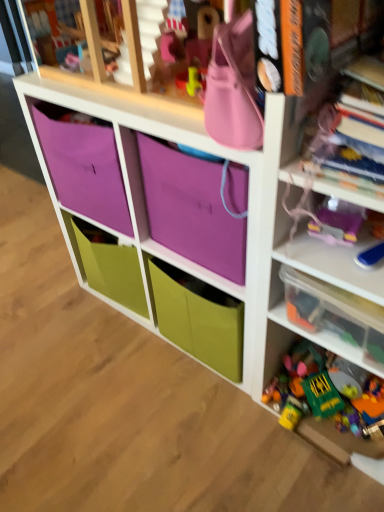
Question: Is purple fabric storage at center turned away from clear plastic container at right?

Choices:
 (A) yes
 (B) no

Answer: (B)

Question: Are purple fabric storage at center and clear plastic container at right far apart?

Choices:
 (A) yes
 (B) no

Answer: (B)

Question: Considering the relative sizes of purple fabric storage at center and clear plastic container at right in the image provided, is purple fabric storage at center thinner than clear plastic container at right?

Choices:
 (A) yes
 (B) no

Answer: (B)

Question: Considering the relative positions of purple fabric storage at center and clear plastic container at right in the image provided, is purple fabric storage at center to the left of clear plastic container at right from the viewer's perspective?

Choices:
 (A) no
 (B) yes

Answer: (B)

Question: Is purple fabric storage at center next to clear plastic container at right and touching it?

Choices:
 (A) yes
 (B) no

Answer: (B)

Question: Considering the relative sizes of purple fabric storage at center and clear plastic container at right in the image provided, is purple fabric storage at center wider than clear plastic container at right?

Choices:
 (A) no
 (B) yes

Answer: (B)

Question: Considering the relative positions of translucent plastic toys at right and purple fabric bag at upper center in the image provided, is translucent plastic toys at right to the left of purple fabric bag at upper center from the viewer's perspective?

Choices:
 (A) yes
 (B) no

Answer: (B)

Question: From the image's perspective, would you say translucent plastic toys at right is shown under purple fabric bag at upper center?

Choices:
 (A) yes
 (B) no

Answer: (A)

Question: Are translucent plastic toys at right and purple fabric bag at upper center located far from each other?

Choices:
 (A) yes
 (B) no

Answer: (B)

Question: Can you confirm if translucent plastic toys at right is taller than purple fabric bag at upper center?

Choices:
 (A) no
 (B) yes

Answer: (B)

Question: Is translucent plastic toys at right wider than purple fabric bag at upper center?

Choices:
 (A) no
 (B) yes

Answer: (B)

Question: Is translucent plastic toys at right positioned behind purple fabric bag at upper center?

Choices:
 (A) no
 (B) yes

Answer: (A)

Question: Is purple fabric bag at upper center bigger than purple fabric storage at center?

Choices:
 (A) no
 (B) yes

Answer: (A)